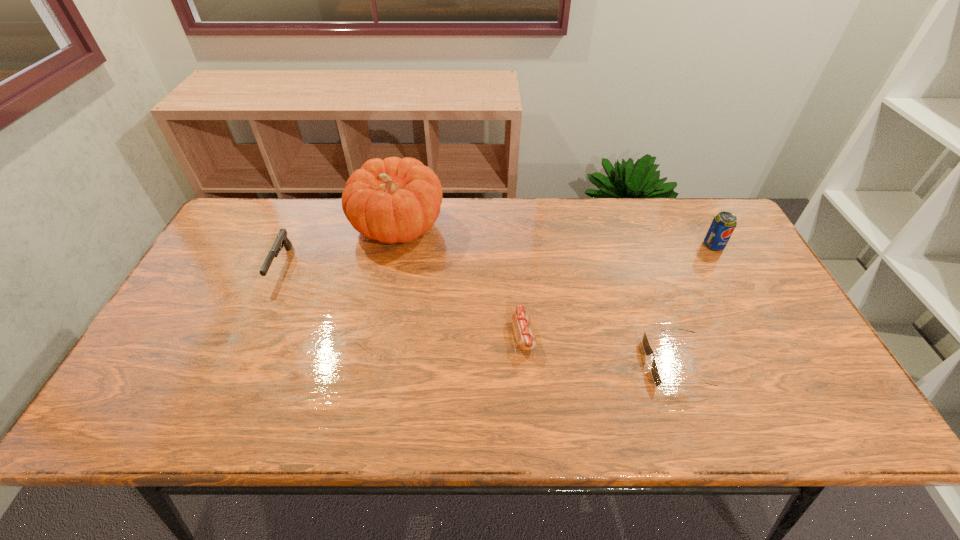
Where is `the tallest object`? The image size is (960, 540). the tallest object is located at coordinates (393, 200).

Locate an element on the screen. This screenshot has height=540, width=960. pumpkin is located at coordinates (393, 200).

At what (x,y) coordinates should I click in order to perform the action: click on the fourth shortest object. Please return your answer as a coordinate pair (x, y). The height and width of the screenshot is (540, 960). Looking at the image, I should click on (723, 224).

Find the location of a particular element. This screenshot has width=960, height=540. the rightmost object is located at coordinates (723, 224).

The width and height of the screenshot is (960, 540). I want to click on the third tallest object, so click(x=281, y=238).

I want to click on gun, so click(x=281, y=238).

At what (x,y) coordinates should I click in order to perform the action: click on sausage. Please return your answer as a coordinate pair (x, y). This screenshot has width=960, height=540. Looking at the image, I should click on (526, 339).

At what (x,y) coordinates should I click in order to perform the action: click on the second shortest object. Please return your answer as a coordinate pair (x, y). The width and height of the screenshot is (960, 540). Looking at the image, I should click on (526, 339).

The height and width of the screenshot is (540, 960). What are the coordinates of `sunglasses` in the screenshot? It's located at (647, 348).

The height and width of the screenshot is (540, 960). I want to click on the shortest object, so click(647, 348).